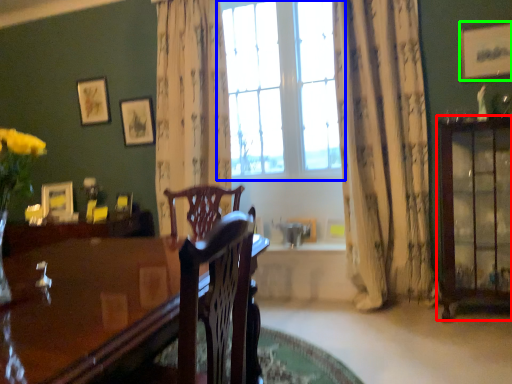
Question: Which object is the farthest from cabinetry (highlighted by a red box)? Choose among these: window (highlighted by a blue box) or picture frame (highlighted by a green box).

Choices:
 (A) window
 (B) picture frame

Answer: (A)